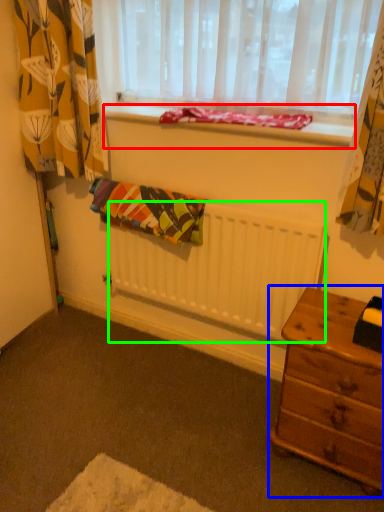
Question: Which is farther away from window sill (highlighted by a red box)? nightstand (highlighted by a blue box) or radiator (highlighted by a green box)?

Choices:
 (A) nightstand
 (B) radiator

Answer: (A)